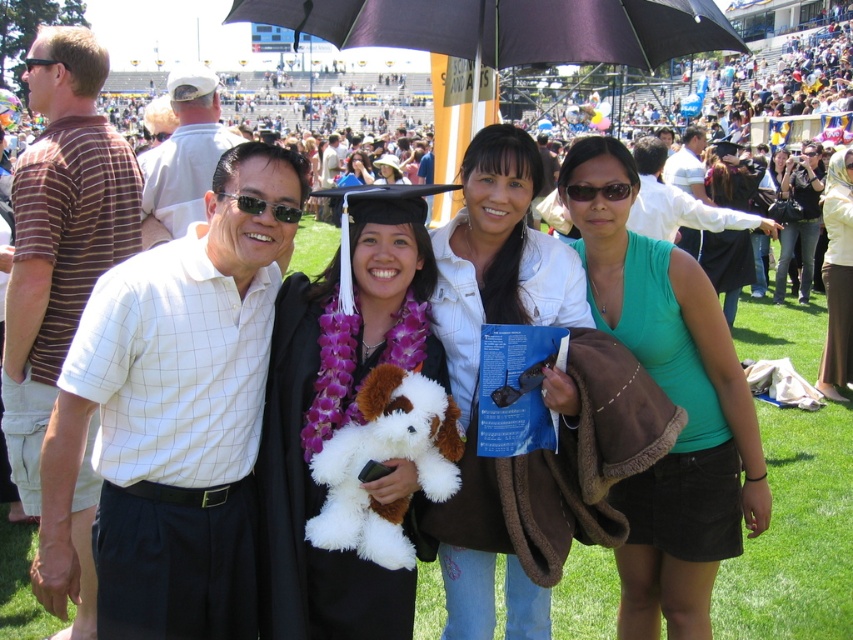
You are a photographer at the graduation ceremony. You need to adjust the lighting so that the matte black graduation gown at center and the light brown fabric skirt at lower right are both well lit. Which object should you focus the light on first based on their positions?

The matte black graduation gown at center is located below the light brown fabric skirt at lower right. Therefore, you should focus the light on the light brown fabric skirt at lower right first to ensure it receives adequate illumination before adjusting for the lower positioned gown.

In the graduation ceremony scene, there is a light brown fabric skirt at lower right located at point (837, 275). What is the color of the skirt at that specific coordinate?

The light brown fabric skirt at lower right is located at point (837, 275), so the color is light brown.